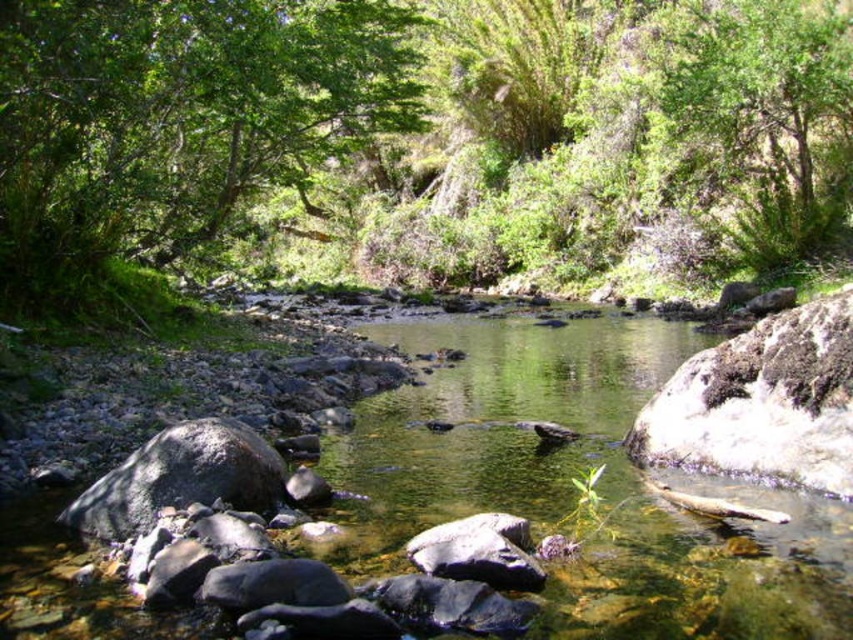
Can you confirm if green leafy forest at center is positioned to the left of clear water at center?

Indeed, green leafy forest at center is positioned on the left side of clear water at center.

Is green leafy forest at center below clear water at center?

Actually, green leafy forest at center is above clear water at center.

Which is behind, point (15, 145) or point (631, 369)?

Point (631, 369)

The image size is (853, 640). I want to click on green leafy forest at center, so click(x=427, y=125).

Between point (621, 346) and point (235, 118), which one is positioned in front?

Point (235, 118) is more forward.

Between point (525, 397) and point (51, 198), which one is positioned in front?

Point (525, 397) is in front.

Image resolution: width=853 pixels, height=640 pixels. Identify the location of clear water at center. (572, 486).

Is point (4, 620) behind point (660, 92)?

No, (4, 620) is in front of (660, 92).

Which is above, clear water at center or green leafy tree at upper right?

green leafy tree at upper right is above.

Where is `clear water at center`? This screenshot has width=853, height=640. clear water at center is located at coordinates (572, 486).